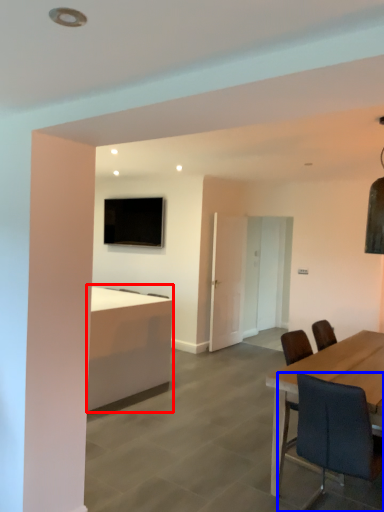
Question: Which object appears farthest to the camera in this image, desk (highlighted by a red box) or chair (highlighted by a blue box)?

Choices:
 (A) desk
 (B) chair

Answer: (A)